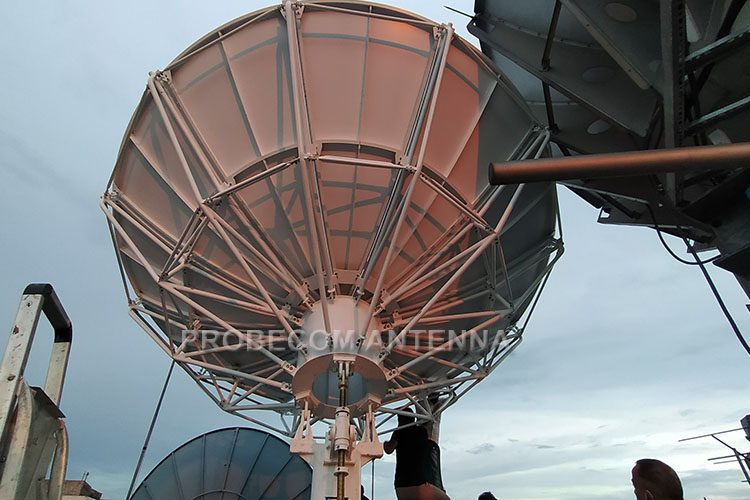
Locate an element on the screen. cables is located at coordinates [724, 313], [152, 417].